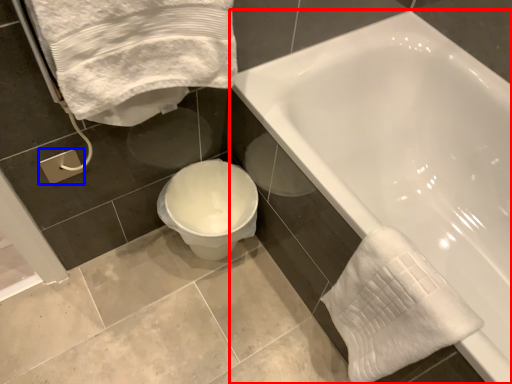
Question: Among these objects, which one is farthest to the camera, bathtub (highlighted by a red box) or towel bar (highlighted by a blue box)?

Choices:
 (A) bathtub
 (B) towel bar

Answer: (B)